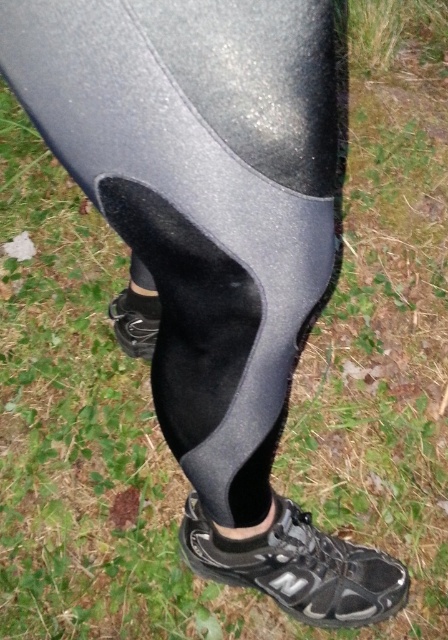
Question: Which object appears closest to the camera in this image?

Choices:
 (A) black mesh shoe at lower center
 (B) black felt sock at lower center
 (C) matte black shoe at lower center

Answer: (A)

Question: Which of the following is the closest to the observer?

Choices:
 (A) (141, 296)
 (B) (149, 330)

Answer: (A)

Question: Which point appears farthest from the camera in this image?

Choices:
 (A) (115, 330)
 (B) (158, 316)

Answer: (A)

Question: Is black mesh shoe at lower center smaller than black felt sock at lower center?

Choices:
 (A) no
 (B) yes

Answer: (A)

Question: Is black mesh shoe at lower center further to camera compared to matte black shoe at lower center?

Choices:
 (A) no
 (B) yes

Answer: (A)

Question: Is matte black shoe at lower center bigger than black felt sock at lower center?

Choices:
 (A) yes
 (B) no

Answer: (A)